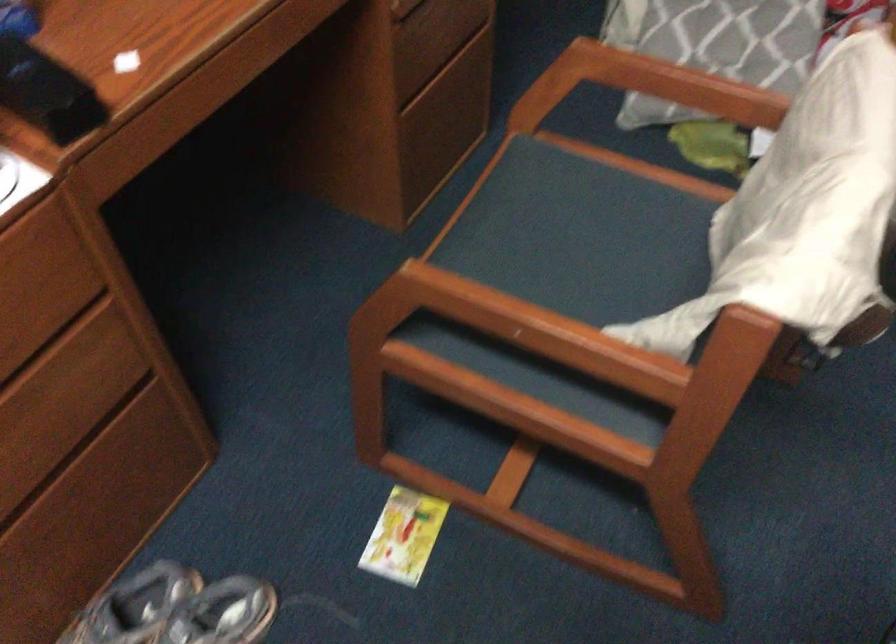
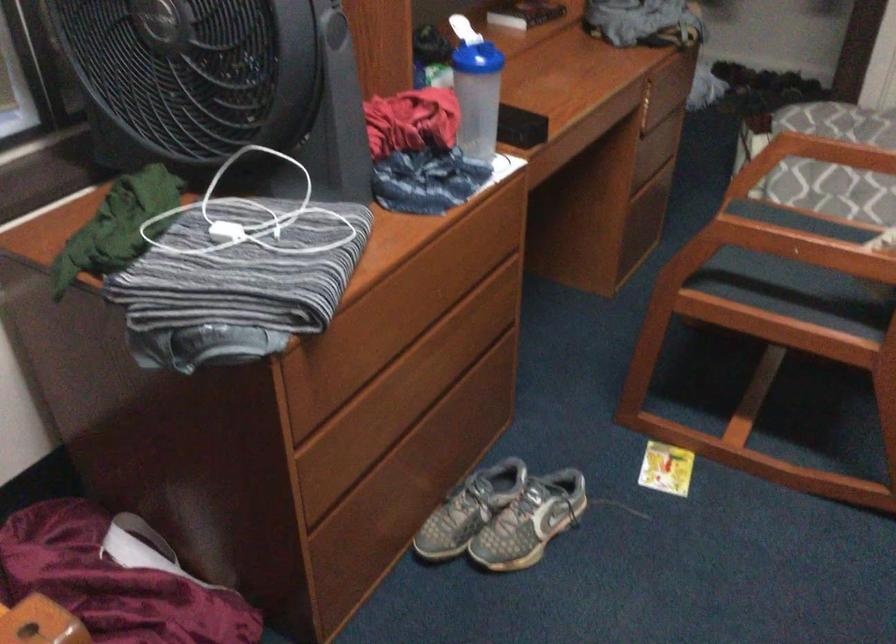
Find the pixel in the second image that matches (547,322) in the first image.

(826, 234)